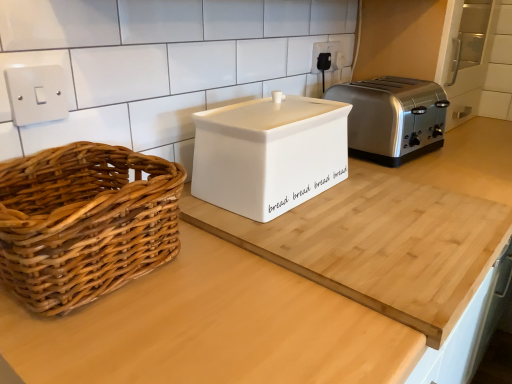
The height and width of the screenshot is (384, 512). Find the location of `satin silver toaster at right`. satin silver toaster at right is located at coordinates (392, 118).

From a real-world perspective, which object stands above the other?

In real-world perspective, satin silver toaster at right is above.

Between point (48, 183) and point (426, 128), which one is positioned behind?

The point (426, 128) is more distant.

Is woven wood picnic basket at left positioned beyond the bounds of satin silver toaster at right?

woven wood picnic basket at left lies outside satin silver toaster at right's area.

In the scene shown: Between woven wood picnic basket at left and satin silver toaster at right, which one is positioned in front?

Positioned in front is woven wood picnic basket at left.

Considering the relative sizes of woven wood picnic basket at left and white plastic electrical outlet at upper center in the image provided, is woven wood picnic basket at left wider than white plastic electrical outlet at upper center?

Indeed, woven wood picnic basket at left has a greater width compared to white plastic electrical outlet at upper center.

Looking at this image, considering the relative positions of woven wood picnic basket at left and white plastic electrical outlet at upper center in the image provided, is woven wood picnic basket at left behind white plastic electrical outlet at upper center?

No, it is in front of white plastic electrical outlet at upper center.

Is woven wood picnic basket at left directly adjacent to white plastic electrical outlet at upper center?

No, woven wood picnic basket at left is not making contact with white plastic electrical outlet at upper center.

From the image's perspective, relative to white plastic electrical outlet at upper center, is woven wood picnic basket at left above or below?

Clearly, from the image's perspective, woven wood picnic basket at left is below white plastic electrical outlet at upper center.

Is woven wood picnic basket at left directly adjacent to white ceramic bread bin at center?

No.

Which is more to the left, woven wood picnic basket at left or white ceramic bread bin at center?

woven wood picnic basket at left.

From the picture: Is woven wood picnic basket at left spatially inside white ceramic bread bin at center, or outside of it?

woven wood picnic basket at left is spatially situated outside white ceramic bread bin at center.

How many degrees apart are the facing directions of white matte bread bin at center and woven wood picnic basket at left?

There is a 0.587-degree angle between the facing directions of white matte bread bin at center and woven wood picnic basket at left.

From their relative heights in the image, would you say white matte bread bin at center is taller or shorter than woven wood picnic basket at left?

Clearly, white matte bread bin at center is taller compared to woven wood picnic basket at left.

What are the coordinates of `picnic basket located above the white matte bread bin at center (from the image's perspective)` in the screenshot? It's located at [84, 222].

From the image's perspective, is white ceramic bread bin at center beneath white plastic electrical outlet at upper center?

Yes, from the image's perspective, white ceramic bread bin at center is beneath white plastic electrical outlet at upper center.

Would you say white ceramic bread bin at center is inside or outside white plastic electrical outlet at upper center?

white ceramic bread bin at center is outside white plastic electrical outlet at upper center.

Who is shorter, white ceramic bread bin at center or white plastic electrical outlet at upper center?

white plastic electrical outlet at upper center is shorter.

How many degrees apart are the facing directions of white ceramic bread bin at center and white plastic electrical outlet at upper center?

The facing directions of white ceramic bread bin at center and white plastic electrical outlet at upper center are 3.53 degrees apart.

Is woven wood picnic basket at left with white matte bread bin at center?

No, woven wood picnic basket at left is not next to white matte bread bin at center.

Considering the relative positions of woven wood picnic basket at left and white matte bread bin at center in the image provided, is woven wood picnic basket at left to the right of white matte bread bin at center from the viewer's perspective?

No.

In order to click on picnic basket lying on the left of white matte bread bin at center in this screenshot , I will do `click(84, 222)`.

Would you say satin silver toaster at right is a long distance from white ceramic bread bin at center?

No, satin silver toaster at right is in close proximity to white ceramic bread bin at center.

From a real-world perspective, is satin silver toaster at right on white ceramic bread bin at center?

Actually, satin silver toaster at right is physically below white ceramic bread bin at center in the real world.

Considering the sizes of satin silver toaster at right and white ceramic bread bin at center in the image, is satin silver toaster at right bigger or smaller than white ceramic bread bin at center?

Considering their sizes, satin silver toaster at right takes up more space than white ceramic bread bin at center.

From the picture: How different are the orientations of satin silver toaster at right and white ceramic bread bin at center in degrees?

satin silver toaster at right and white ceramic bread bin at center are facing 0.165 degrees away from each other.

There is a woven wood picnic basket at left. Identify the location of toaster above it (from a real-world perspective). click(392, 118).

Identify the location of picnic basket on the left of white plastic electrical outlet at upper center. This screenshot has height=384, width=512. (84, 222).

From the image, which object appears to be nearer to white matte bread bin at center, white plastic electrical outlet at upper center or satin silver toaster at right?

Among the two, satin silver toaster at right is located nearer to white matte bread bin at center.

From the image, which object appears to be nearer to white plastic electrical outlet at upper center, white ceramic bread bin at center or satin silver toaster at right?

Based on the image, satin silver toaster at right appears to be nearer to white plastic electrical outlet at upper center.

Which object lies further to the anchor point white matte bread bin at center, white plastic electrical outlet at upper center or white ceramic bread bin at center?

white plastic electrical outlet at upper center.

Which object lies further to the anchor point white ceramic bread bin at center, white matte bread bin at center or white plastic electrical outlet at upper center?

white plastic electrical outlet at upper center lies further to white ceramic bread bin at center than the other object.

Estimate the real-world distances between objects in this image. Which object is closer to woven wood picnic basket at left, white plastic electrical outlet at upper center or white matte bread bin at center?

white matte bread bin at center.

From the image, which object appears to be farther from satin silver toaster at right, white plastic electrical outlet at upper center or white ceramic bread bin at center?

Result: Based on the image, white ceramic bread bin at center appears to be further to satin silver toaster at right.

When comparing their distances from white ceramic bread bin at center, does satin silver toaster at right or white matte bread bin at center seem closer?

Among the two, white matte bread bin at center is located nearer to white ceramic bread bin at center.

Which object lies further to the anchor point white matte bread bin at center, white ceramic bread bin at center or woven wood picnic basket at left?

woven wood picnic basket at left is positioned further to the anchor white matte bread bin at center.

You are a GUI agent. You are given a task and a screenshot of the screen. Output one action in this format:
    pyautogui.click(x=<x>, y=<y>)
    Task: Click on the toaster between white matte bread bin at center and white plastic electrical outlet at upper center in the front-back direction
    The height and width of the screenshot is (384, 512).
    Given the screenshot: What is the action you would take?
    pyautogui.click(x=392, y=118)

At what (x,y) coordinates should I click in order to perform the action: click on appliance between white matte bread bin at center and satin silver toaster at right along the z-axis. Please return your answer as a coordinate pair (x, y). The height and width of the screenshot is (384, 512). Looking at the image, I should click on (269, 154).

Find the location of a particular element. The width and height of the screenshot is (512, 384). appliance situated between woven wood picnic basket at left and white matte bread bin at center from left to right is located at coordinates (269, 154).

Locate an element on the screen. This screenshot has width=512, height=384. appliance located between woven wood picnic basket at left and white plastic electrical outlet at upper center in the depth direction is located at coordinates (269, 154).